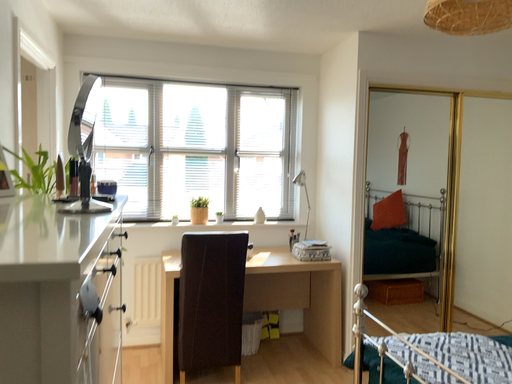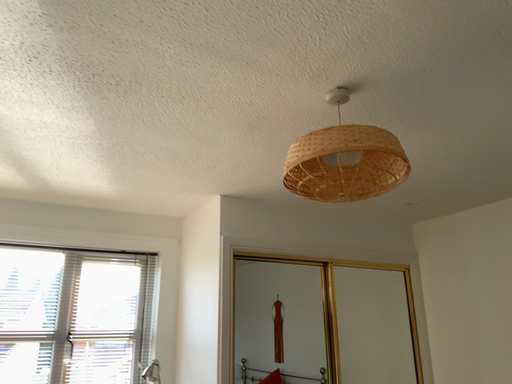
Question: Which way did the camera rotate in the video?

Choices:
 (A) rotated downward
 (B) rotated upward

Answer: (B)